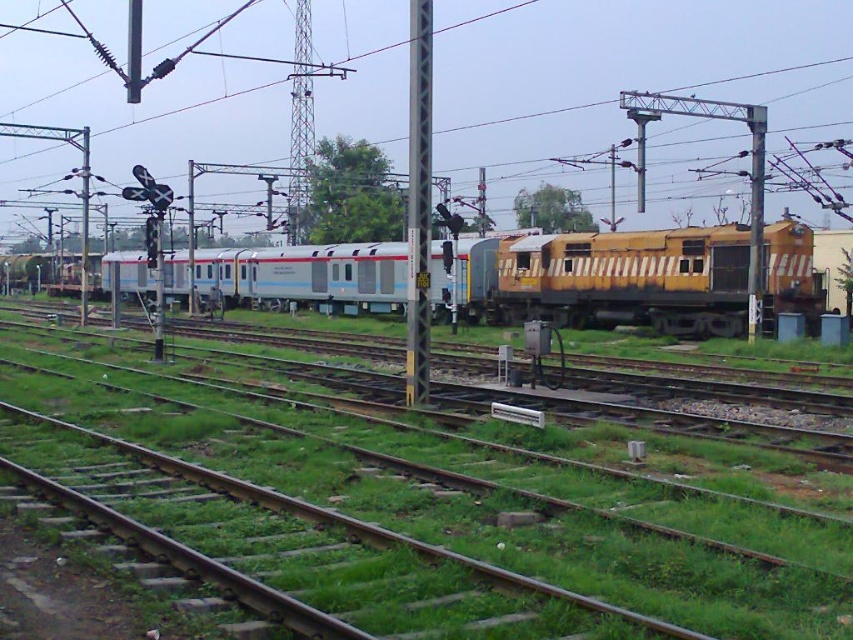
Between yellow matte train at center and metallic gray pole at center, which one is positioned lower?

yellow matte train at center is below.

Does yellow matte train at center have a smaller size compared to metallic gray pole at center?

Incorrect, yellow matte train at center is not smaller in size than metallic gray pole at center.

Find the location of a particular element. The height and width of the screenshot is (640, 853). yellow matte train at center is located at coordinates (610, 280).

The image size is (853, 640). What are the coordinates of `yellow matte train at center` in the screenshot? It's located at (610, 280).

Which of these two, green grass at center or yellow matte train at center, stands shorter?

With less height is green grass at center.

Is point (294, 524) more distant than point (706, 244)?

No, (294, 524) is in front of (706, 244).

Between point (432, 513) and point (358, 296), which one is positioned in front?

Point (432, 513) is in front.

Locate an element on the screen. This screenshot has width=853, height=640. green grass at center is located at coordinates (428, 500).

Who is more distant from viewer, (x=97, y=412) or (x=408, y=209)?

Point (x=408, y=209)

Is green grass at center further to the viewer compared to metallic gray pole at center?

No, green grass at center is closer to the viewer.

Locate an element on the screen. green grass at center is located at coordinates (428, 500).